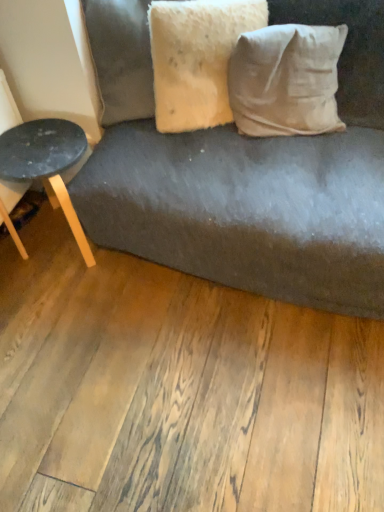
You are a GUI agent. You are given a task and a screenshot of the screen. Output one action in this format:
    pyautogui.click(x=<x>, y=<y>)
    Task: Click on the free space above matte black stool at left (from a real-world perspective)
    This screenshot has width=384, height=512.
    Given the screenshot: What is the action you would take?
    pyautogui.click(x=35, y=143)